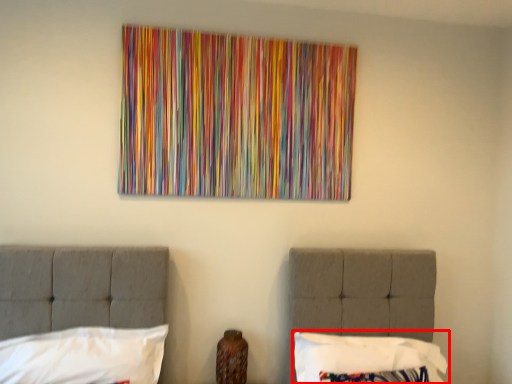
Question: From the image's perspective, what is the correct spatial relationship of pillow (annotated by the red box) in relation to pillow?

Choices:
 (A) above
 (B) below

Answer: (B)